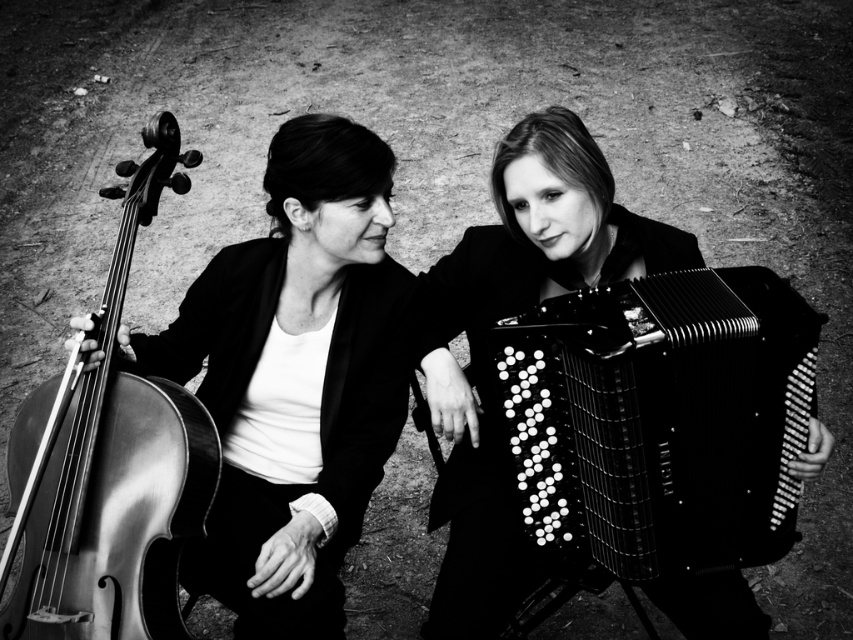
From the picture: You are a photographer trying to capture both the shiny black cello at left and the black matte accordion at center in a single frame. Based on their widths, which object should you adjust your camera angle to focus on first to ensure both fit properly?

The shiny black cello at left is wider than the black matte accordion at center, so you should focus on adjusting your camera angle to accommodate the wider shiny black cello at left first to ensure both fit properly.

You are a photographer trying to capture a closeup of the shiny black cello at left and the black matte accordion at center. Which object should you focus on first if you want to ensure both are in focus without moving the camera?

The shiny black cello at left is located above the black matte accordion at center. To ensure both are in focus, focus on the shiny black cello at left first since it is closer to the camera, allowing the accordion at center to fall within the depth of field.

You are a photographer adjusting your camera to focus on the shiny black cello at left. What are the coordinates you should input into your camera to ensure it focuses precisely on the cello?

The coordinates for the shiny black cello at left are 0.594 on the x axis and 0.348 on the y axis. Input these into your camera to focus on the cello.